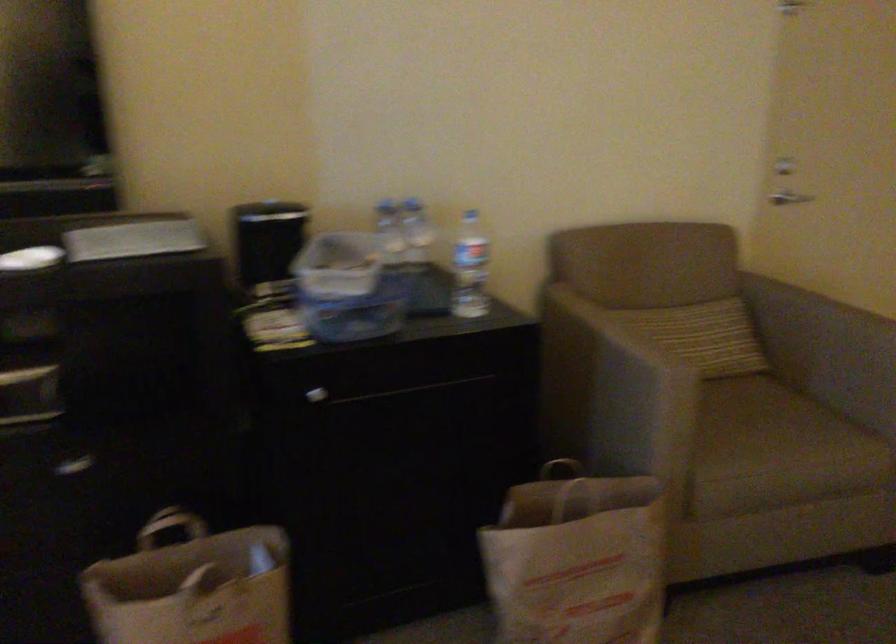
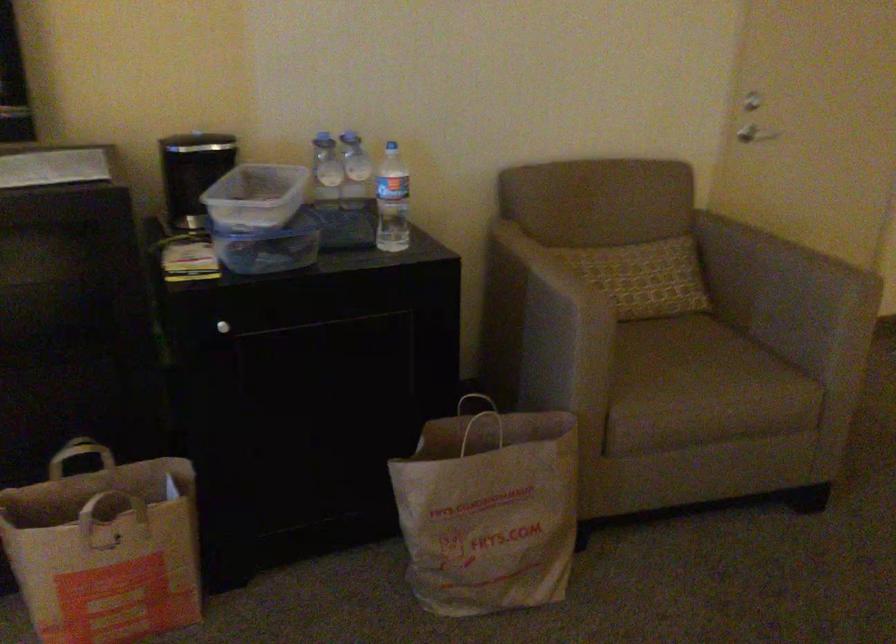
In the second image, find the point that corresponds to point (171, 532) in the first image.

(82, 458)